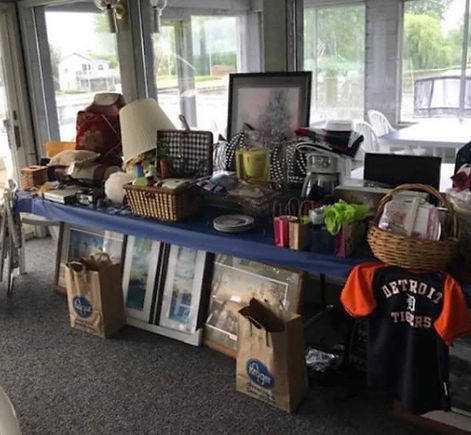
The width and height of the screenshot is (471, 435). Find the location of `table cloth`. table cloth is located at coordinates click(x=197, y=224), click(x=266, y=236), click(x=59, y=214).